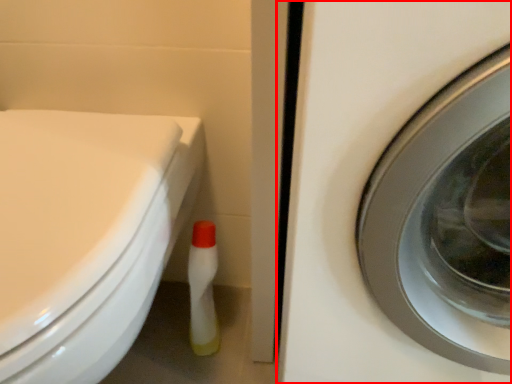
Question: Where is washing machine (annotated by the red box) located in relation to bidet in the image?

Choices:
 (A) right
 (B) left

Answer: (A)